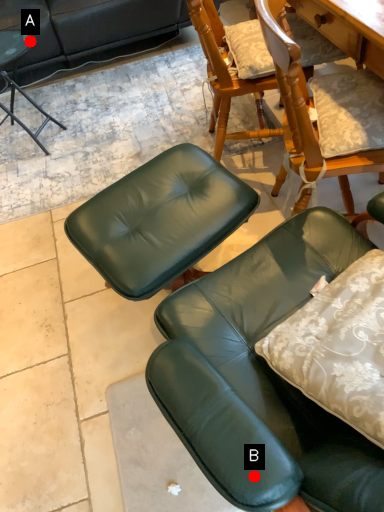
Question: Two points are circled on the image, labeled by A and B beside each circle. Which point is closer to the camera taking this photo?

Choices:
 (A) A is closer
 (B) B is closer

Answer: (B)